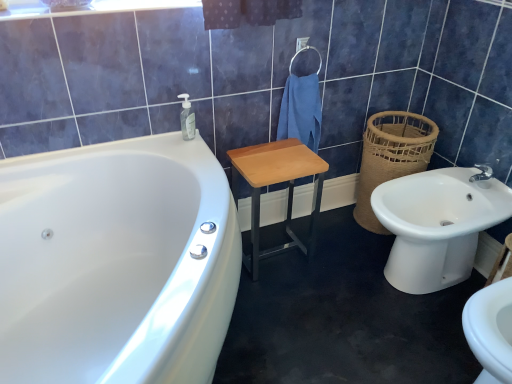
Where is `vacant region to the left of white ceramic sink at right`? This screenshot has height=384, width=512. vacant region to the left of white ceramic sink at right is located at coordinates (329, 278).